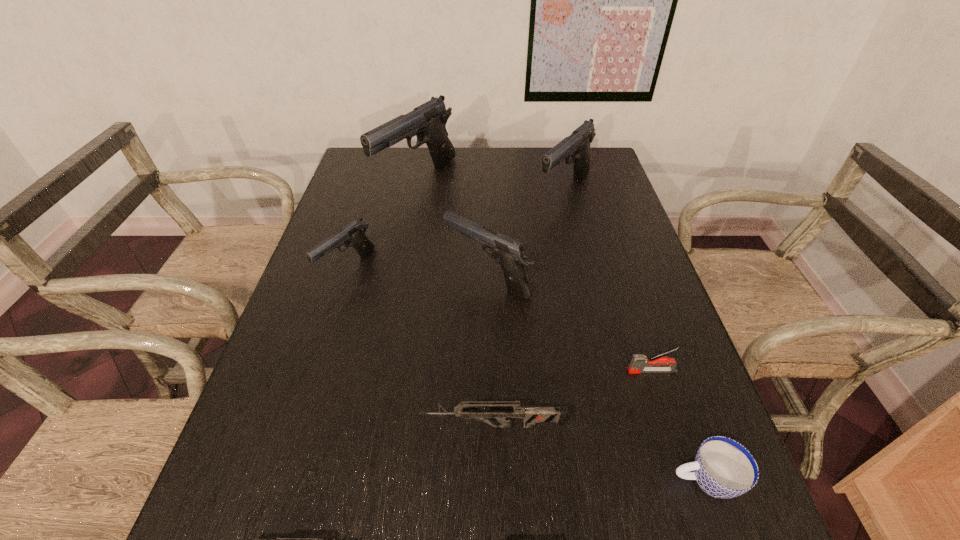
In order to click on free space between the tallest object and the fourth tallest gun in this screenshot , I will do [x=382, y=224].

Identify the location of free space between the smallest black gun and the tallest gun. (382, 224).

At what (x,y) coordinates should I click in order to perform the action: click on empty location between the fifth farthest object and the second biggest black gun. Please return your answer as a coordinate pair (x, y). Looking at the image, I should click on (608, 281).

This screenshot has width=960, height=540. Identify the location of free space between the smallest black gun and the second shortest object. (526, 374).

Find the location of `free space between the fifth farthest object and the fourth shortest gun`. free space between the fifth farthest object and the fourth shortest gun is located at coordinates (570, 325).

Identify the location of unoccupied position between the gray stapler and the second nearest object. This screenshot has width=960, height=540. (679, 426).

Identify the location of the closest object relative to the biggest black gun. (353, 235).

Identify which object is the sixth nearest to the third tallest object. Please provide its 2D coordinates. Your answer should be formatted as a tuple, i.e. [(x, y)], where the tuple contains the x and y coordinates of a point satisfying the conditions above.

[(723, 468)]

Identify which gun is the third nearest to the nearest object. Please provide its 2D coordinates. Your answer should be formatted as a tuple, i.e. [(x, y)], where the tuple contains the x and y coordinates of a point satisfying the conditions above.

[(353, 235)]

Identify the location of the second closest gun relative to the second biggest black gun. (428, 121).